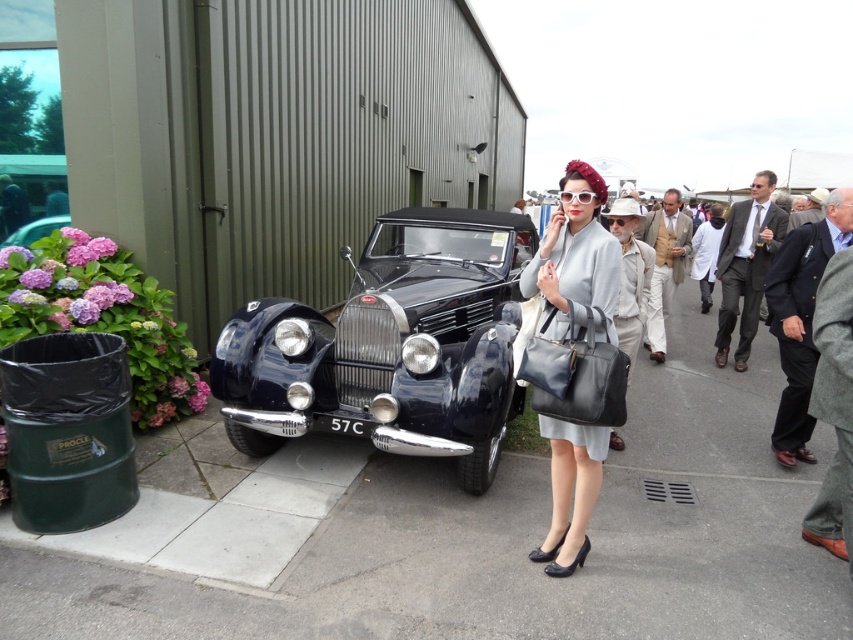
You are a tailor observing a classic black convertible car at the vintage event. You notice a light beige fabric suit at center and a light beige fabric briefcase at center. Which item is taller?

The light beige fabric suit at center is much taller than the light beige fabric briefcase at center.

You are a tailor at the vintage car event and need to retrieve both the gray wool suit at right and the light brown suit at center. Which suit should you approach first if you are standing to the left of the car?

You should approach the gray wool suit at right first because it is to the left of the light brown suit at center, so it is closer to your current position.